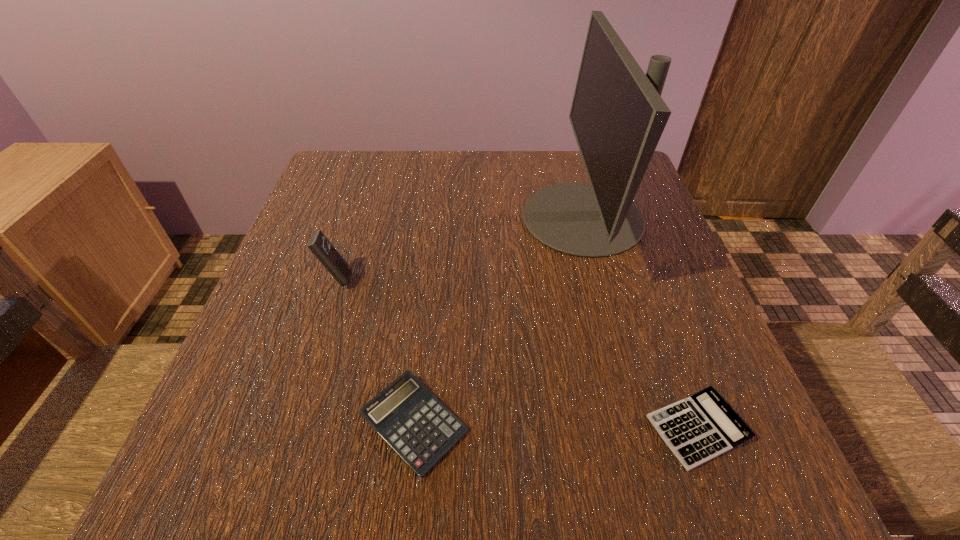
The width and height of the screenshot is (960, 540). Find the location of `vacant position in the image that satisfies the following two spatial constraints: 1. on the front-facing side of the rightmost calculator; 2. on the right side of the leftmost calculator`. vacant position in the image that satisfies the following two spatial constraints: 1. on the front-facing side of the rightmost calculator; 2. on the right side of the leftmost calculator is located at coordinates (288, 429).

This screenshot has width=960, height=540. Find the location of `blank area in the image that satisfies the following two spatial constraints: 1. on the front-facing side of the second tallest object; 2. on the back side of the second shortest object`. blank area in the image that satisfies the following two spatial constraints: 1. on the front-facing side of the second tallest object; 2. on the back side of the second shortest object is located at coordinates click(290, 423).

Where is `free space that satisfies the following two spatial constraints: 1. on the screen of the tallest object; 2. on the right side of the shortest calculator`? This screenshot has width=960, height=540. free space that satisfies the following two spatial constraints: 1. on the screen of the tallest object; 2. on the right side of the shortest calculator is located at coordinates (639, 429).